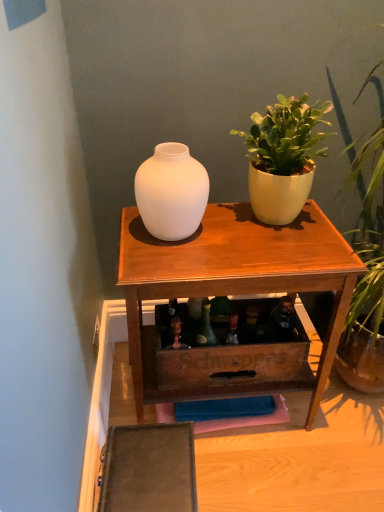
The width and height of the screenshot is (384, 512). What do you see at coordinates (171, 192) in the screenshot?
I see `matte white vase at center` at bounding box center [171, 192].

I want to click on matte white vase at upper center, so click(234, 294).

This screenshot has height=512, width=384. Identify the location of matte white vase at center. (171, 192).

Does point (158, 214) come behind point (212, 291)?

Yes.

Is matte white vase at upper center inside matte white vase at center?

No.

Is matte white vase at center beside matte white vase at upper center?

No.

Where is `table lying on the right of matte white vase at center`? Image resolution: width=384 pixels, height=512 pixels. table lying on the right of matte white vase at center is located at coordinates pos(234,294).

Does matte white vase at upper center have a larger size compared to matte white vase at center?

Correct, matte white vase at upper center is larger in size than matte white vase at center.

Is matte white vase at upper center to the right of matte white vase at center from the viewer's perspective?

Correct, you'll find matte white vase at upper center to the right of matte white vase at center.

Can you tell me how much matte white vase at upper center and matte white vase at center differ in facing direction?

0.121 degrees.

Is matte white vase at upper center touching matte white vase at center?

matte white vase at upper center is not next to matte white vase at center, and they're not touching.

Looking at this image, between matte white vase at center and matte yellow pot at upper right, which one has less height?

With less height is matte white vase at center.

Is matte white vase at center closer to the viewer compared to matte yellow pot at upper right?

No, matte white vase at center is behind matte yellow pot at upper right.

How far apart are matte white vase at center and matte yellow pot at upper right?

matte white vase at center is 9.78 inches from matte yellow pot at upper right.

Could matte yellow pot at upper right be considered to be inside matte white vase at center?

No, matte yellow pot at upper right is located outside of matte white vase at center.

Which is closer, [161,367] or [239,135]?

The point [161,367] is in front.

Can you confirm if matte white vase at upper center is positioned to the left of matte yellow pot at upper right?

Indeed, matte white vase at upper center is positioned on the left side of matte yellow pot at upper right.

From a real-world perspective, is matte white vase at upper center positioned above or below matte yellow pot at upper right?

From a real-world perspective, matte white vase at upper center is physically below matte yellow pot at upper right.

The width and height of the screenshot is (384, 512). I want to click on houseplant in front of the matte white vase at upper center, so click(x=283, y=157).

From a real-world perspective, who is located lower, matte yellow pot at upper right or matte white vase at center?

matte white vase at center, from a real-world perspective.

This screenshot has width=384, height=512. Identify the location of houseplant above the matte white vase at center (from the image's perspective). (283, 157).

Between matte yellow pot at upper right and matte white vase at center, which one has larger size?

With larger size is matte yellow pot at upper right.

Is matte yellow pot at upper right turned away from matte white vase at center?

A: No.

Can you confirm if matte yellow pot at upper right is smaller than matte white vase at upper center?

Yes, matte yellow pot at upper right is smaller than matte white vase at upper center.

Does point (291, 153) come in front of point (210, 353)?

That is True.

In the scene shown: Can you confirm if matte yellow pot at upper right is shorter than matte white vase at upper center?

Correct, matte yellow pot at upper right is not as tall as matte white vase at upper center.

Considering the positions of objects matte yellow pot at upper right and matte white vase at upper center in the image provided, who is more to the right, matte yellow pot at upper right or matte white vase at upper center?

From the viewer's perspective, matte yellow pot at upper right appears more on the right side.

The height and width of the screenshot is (512, 384). I want to click on vase lying in front of the matte white vase at upper center, so click(x=171, y=192).

Where is `vase that is above the matte white vase at upper center (from the image's perspective)`? Image resolution: width=384 pixels, height=512 pixels. vase that is above the matte white vase at upper center (from the image's perspective) is located at coordinates (171, 192).

From the image, which object appears to be nearer to matte yellow pot at upper right, matte white vase at upper center or matte white vase at center?

The object closer to matte yellow pot at upper right is matte white vase at center.

From the image, which object appears to be farther from matte white vase at center, matte white vase at upper center or matte yellow pot at upper right?

matte white vase at upper center is further to matte white vase at center.

From the image, which object appears to be nearer to matte white vase at center, matte yellow pot at upper right or matte white vase at upper center?

Among the two, matte yellow pot at upper right is located nearer to matte white vase at center.

Considering their positions, is matte white vase at center positioned further to matte yellow pot at upper right than matte white vase at upper center?

Based on the image, matte white vase at upper center appears to be further to matte yellow pot at upper right.

Which object lies nearer to the anchor point matte white vase at upper center, matte yellow pot at upper right or matte white vase at center?

Among the two, matte white vase at center is located nearer to matte white vase at upper center.

Considering their positions, is matte white vase at center positioned further to matte white vase at upper center than matte yellow pot at upper right?

Among the two, matte yellow pot at upper right is located further to matte white vase at upper center.

You are a GUI agent. You are given a task and a screenshot of the screen. Output one action in this format:
    pyautogui.click(x=<x>, y=<y>)
    Task: Click on the vase between matte yellow pot at upper right and matte white vase at upper center in the vertical direction
    This screenshot has width=384, height=512.
    Given the screenshot: What is the action you would take?
    pyautogui.click(x=171, y=192)